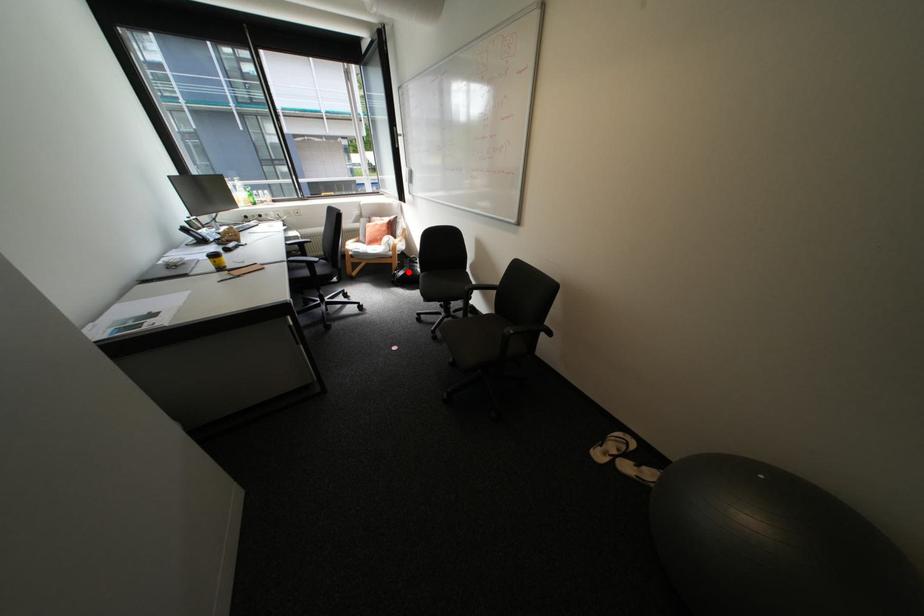
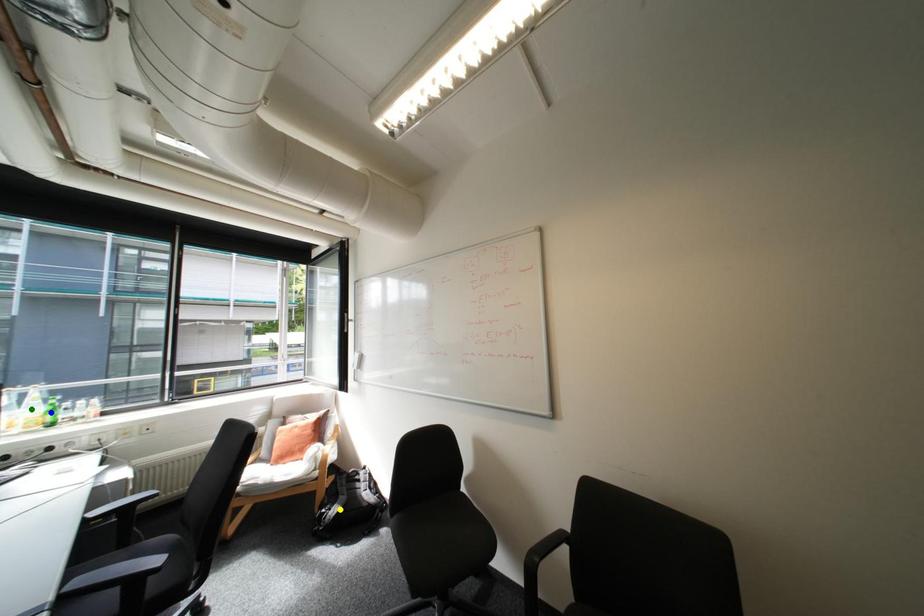
Question: I am providing you with two images of the same scene from different viewpoints. A red point is marked on the first image. You are given multiple points on the second image. Which point in image 2 is actually the same real-world point as the red point in image 1?

Choices:
 (A) green point
 (B) blue point
 (C) yellow point

Answer: (C)